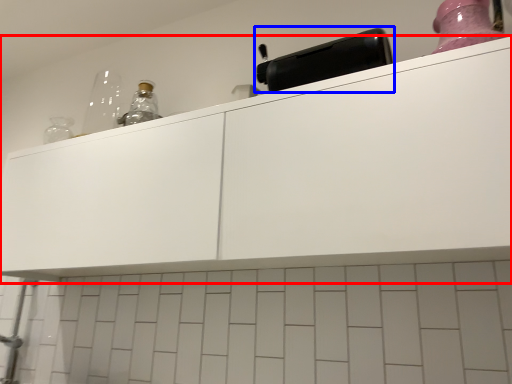
Question: Among these objects, which one is nearest to the camera, cabinetry (highlighted by a red box) or appliance (highlighted by a blue box)?

Choices:
 (A) cabinetry
 (B) appliance

Answer: (A)